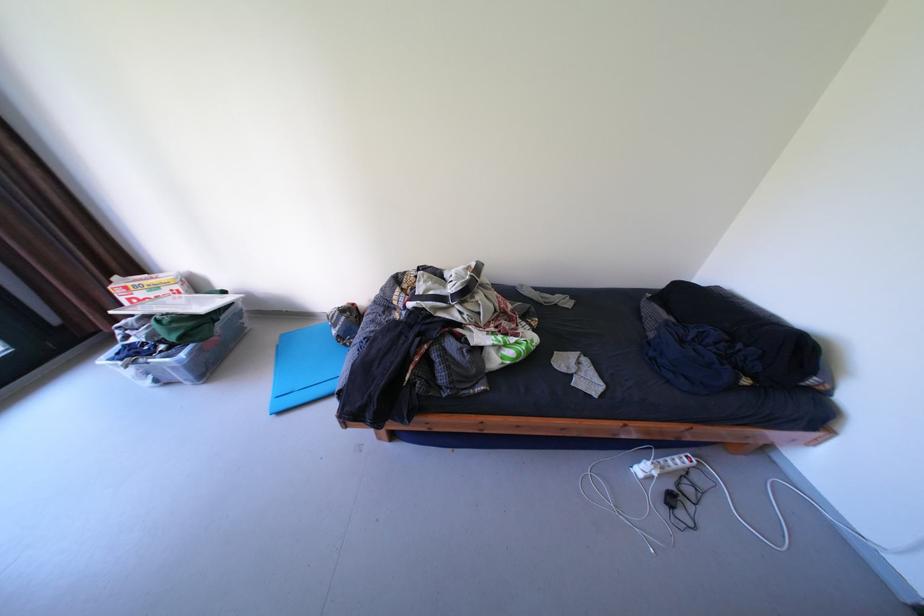
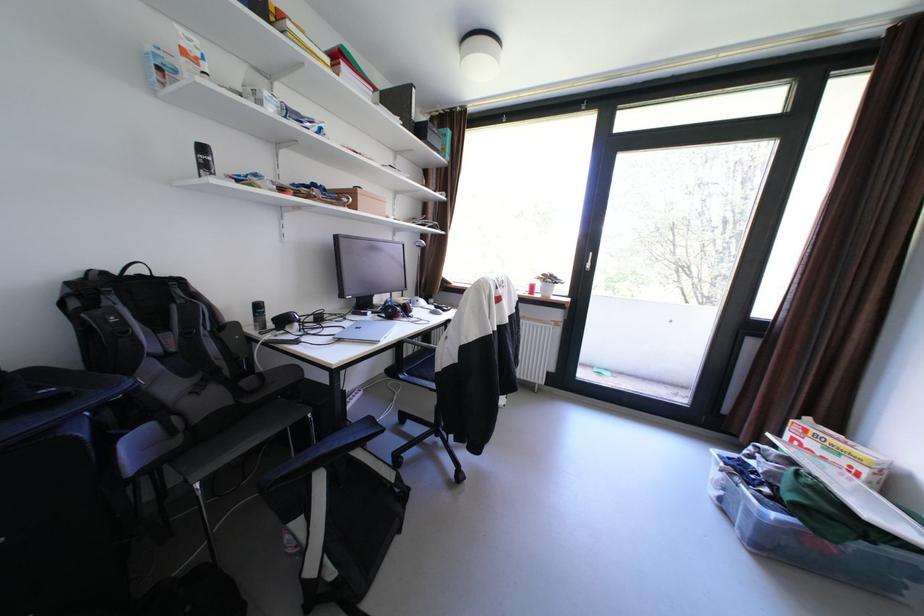
The point at (193,355) is marked in the first image. Where is the corresponding point in the second image?

(784, 516)